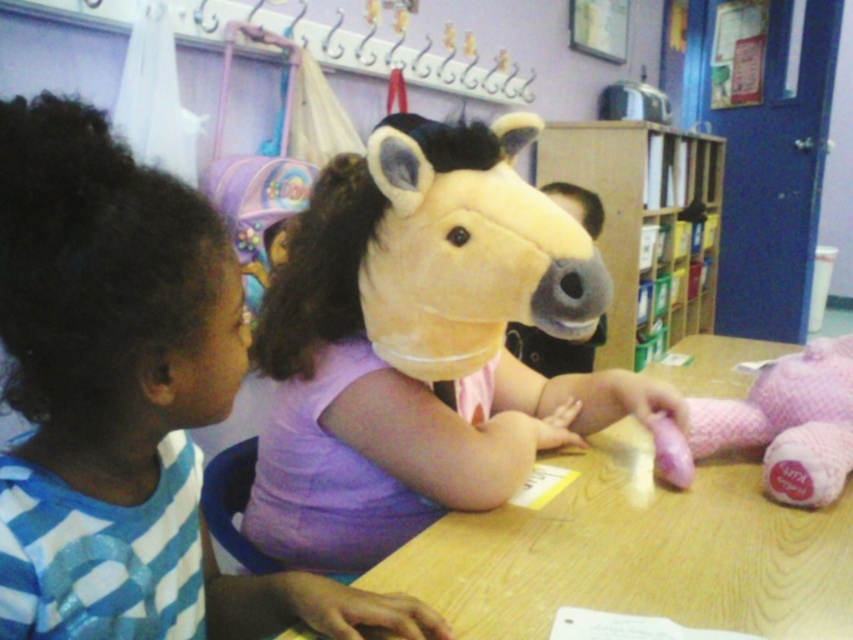
You are a teacher in the classroom and want to place both the soft plush horse head at center and the pink plush bear at right on a shelf. The shelf has limited vertical space. Which one should you place first to ensure both fit?

The soft plush horse head at center is taller than the pink plush bear at right, so you should place the taller one first to accommodate its height before placing the smaller one.

You are a teacher observing the classroom scene. You notice the purple cotton shirt at upper center and the wooden table at center. Which object is positioned more to the left in the image?

The purple cotton shirt at upper center is positioned more to the left than the wooden table at center according to the description.

You are a teacher in the classroom. You need to place a 10 cm wide textbook on the wooden table at center or the wooden bookshelf at center. Based on their widths, which surface can fit the textbook without overhanging?

The wooden bookshelf at center is wider than the wooden table at center. Since the textbook is 10 cm wide, it can fit on the wooden bookshelf at center without overhanging.